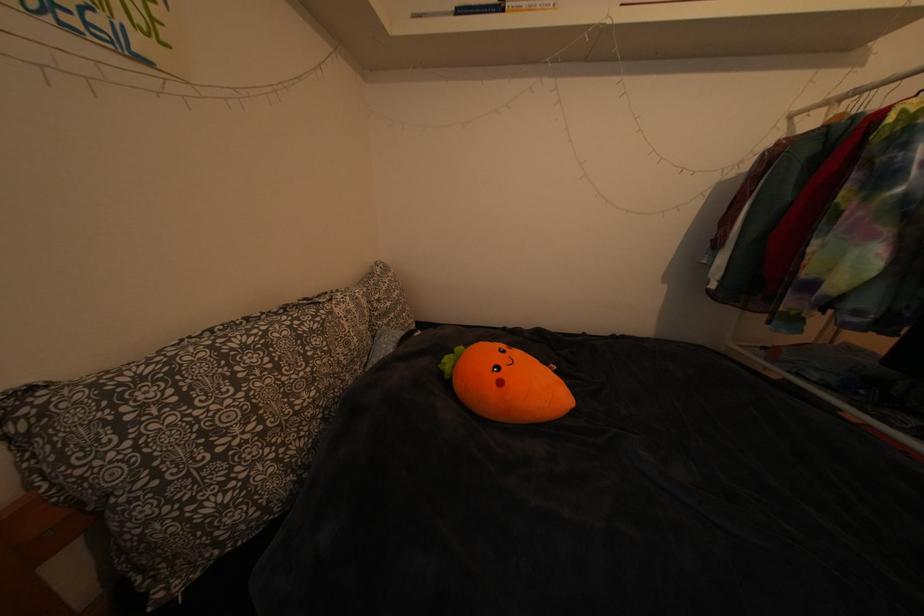
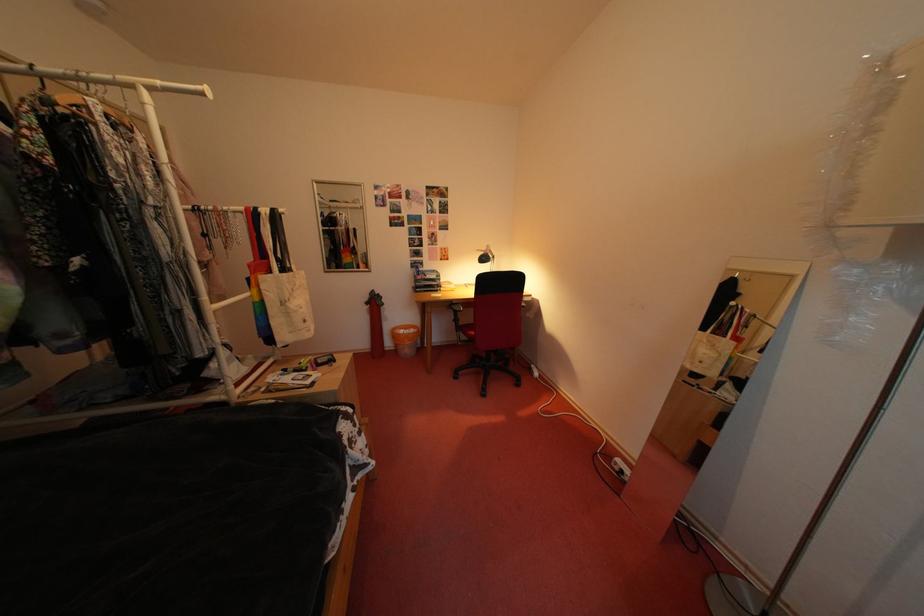
Based on the continuous images, in which direction is the camera rotating?

The camera rotated toward right-down.